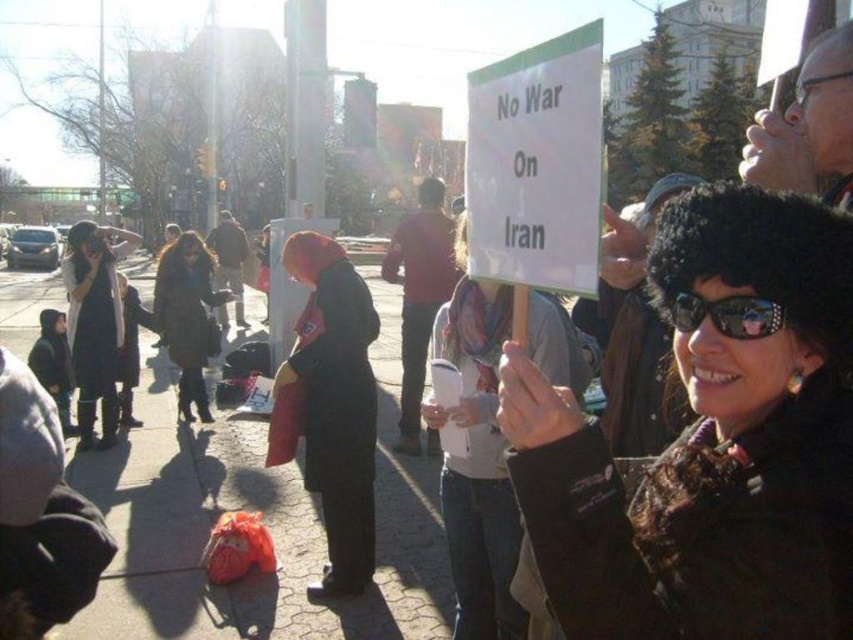
Question: Which point is closer to the camera taking this photo?

Choices:
 (A) (733, 198)
 (B) (474, 369)
 (C) (192, 326)
 (D) (669, 317)

Answer: (A)

Question: Which object is farther from the camera taking this photo?

Choices:
 (A) white paper sign at center
 (B) black fur hat at center

Answer: (A)

Question: Which of the following is the farthest from the observer?

Choices:
 (A) dark brown leather coat at center
 (B) black fur hat at center

Answer: (A)

Question: Where is white paper sign at center located in relation to sunglasses at center in the image?

Choices:
 (A) below
 (B) above

Answer: (A)

Question: Can you confirm if black fur hat at center is positioned below dark brown leather coat at center?

Choices:
 (A) no
 (B) yes

Answer: (A)

Question: Is dark brown leather coat at center to the right of sunglasses at center from the viewer's perspective?

Choices:
 (A) no
 (B) yes

Answer: (A)